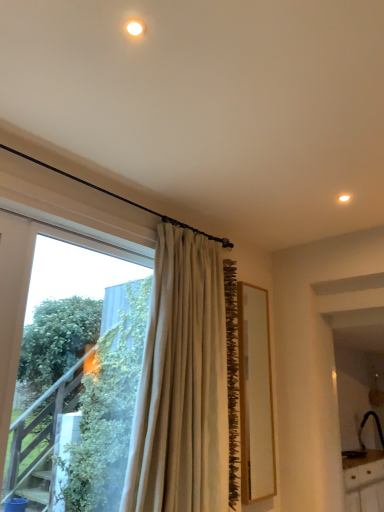
What do you see at coordinates (182, 384) in the screenshot?
I see `beige fabric curtain at center` at bounding box center [182, 384].

Measure the distance between black matte sink at lower right and camera.

black matte sink at lower right is 14.65 feet away from camera.

This screenshot has height=512, width=384. What are the coordinates of `transparent glass window at left` in the screenshot? It's located at (46, 284).

Does point (206, 463) come behind point (349, 456)?

No, (206, 463) is closer to viewer.

Looking at this image, is beige fabric curtain at center facing away from black matte sink at lower right?

beige fabric curtain at center is not turned away from black matte sink at lower right.

How many degrees apart are the facing directions of beige fabric curtain at center and black matte sink at lower right?

The angular difference between beige fabric curtain at center and black matte sink at lower right is 2.48 degrees.

Is beige fabric curtain at center at the left side of black matte sink at lower right?

Correct, you'll find beige fabric curtain at center to the left of black matte sink at lower right.

Which is behind, point (365, 414) or point (138, 460)?

The point (365, 414) is farther from the camera.

Locate an element on the screen. The image size is (384, 512). sink below the beige fabric curtain at center (from the image's perspective) is located at coordinates (362, 440).

Is black matte sink at lower right behind beige fabric curtain at center?

Yes.

Who is bigger, black matte sink at lower right or beige fabric curtain at center?

beige fabric curtain at center.

Does beige fabric curtain at center turn towards transparent glass window at left?

No, beige fabric curtain at center is not oriented towards transparent glass window at left.

Is beige fabric curtain at center smaller than transparent glass window at left?

No.

Find the location of a particular element. curtain that appears below the transparent glass window at left (from the image's perspective) is located at coordinates (182, 384).

Could you tell me if transparent glass window at left is facing beige fabric curtain at center?

No, transparent glass window at left is not turned towards beige fabric curtain at center.

From the picture: Are transparent glass window at left and beige fabric curtain at center located far from each other?

No, transparent glass window at left is not far away from beige fabric curtain at center.

Is transparent glass window at left inside or outside of beige fabric curtain at center?

The correct answer is: outside.

Between transparent glass window at left and beige fabric curtain at center, which one appears on the right side from the viewer's perspective?

Positioned to the right is beige fabric curtain at center.

Consider the image. From the image's perspective, is transparent glass window at left located above or below black matte sink at lower right?

Clearly, from the image's perspective, transparent glass window at left is above black matte sink at lower right.

Can you tell me how much transparent glass window at left and black matte sink at lower right differ in facing direction?

transparent glass window at left and black matte sink at lower right are facing 0.265 degrees away from each other.

Measure the distance between transparent glass window at left and black matte sink at lower right.

11.91 feet.

Locate an element on the screen. window in front of the black matte sink at lower right is located at coordinates (46, 284).

Is black matte sink at lower right with transparent glass window at left?

No, black matte sink at lower right is not touching transparent glass window at left.

How much distance is there between black matte sink at lower right and transparent glass window at left?

black matte sink at lower right is 3.63 meters away from transparent glass window at left.

Between black matte sink at lower right and transparent glass window at left, which one appears on the left side from the viewer's perspective?

From the viewer's perspective, transparent glass window at left appears more on the left side.

Between black matte sink at lower right and transparent glass window at left, which one has larger width?

black matte sink at lower right is wider.

Where is `sink below the beige fabric curtain at center (from a real-world perspective)`? sink below the beige fabric curtain at center (from a real-world perspective) is located at coordinates (362, 440).

Where is `sink on the right of the beige fabric curtain at center`? The image size is (384, 512). sink on the right of the beige fabric curtain at center is located at coordinates point(362,440).

Consider the image. Looking at the image, which one is located closer to black matte sink at lower right, beige fabric curtain at center or transparent glass window at left?

Among the two, beige fabric curtain at center is located nearer to black matte sink at lower right.

Consider the image. Based on their spatial positions, is black matte sink at lower right or transparent glass window at left closer to beige fabric curtain at center?

transparent glass window at left is positioned closer to the anchor beige fabric curtain at center.

Considering their positions, is black matte sink at lower right positioned further to transparent glass window at left than beige fabric curtain at center?

black matte sink at lower right is positioned further to the anchor transparent glass window at left.

When comparing their distances from transparent glass window at left, does beige fabric curtain at center or black matte sink at lower right seem closer?

beige fabric curtain at center is closer to transparent glass window at left.

Estimate the real-world distances between objects in this image. Which object is closer to beige fabric curtain at center, transparent glass window at left or black matte sink at lower right?

Among the two, transparent glass window at left is located nearer to beige fabric curtain at center.

Considering their positions, is transparent glass window at left positioned closer to black matte sink at lower right than beige fabric curtain at center?

Based on the image, beige fabric curtain at center appears to be nearer to black matte sink at lower right.

Find the location of a particular element. Image resolution: width=384 pixels, height=512 pixels. curtain located between transparent glass window at left and black matte sink at lower right in the depth direction is located at coordinates (182, 384).